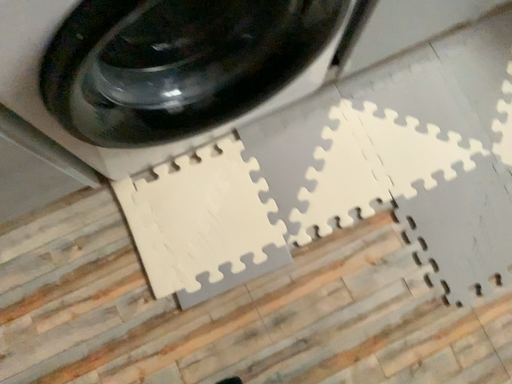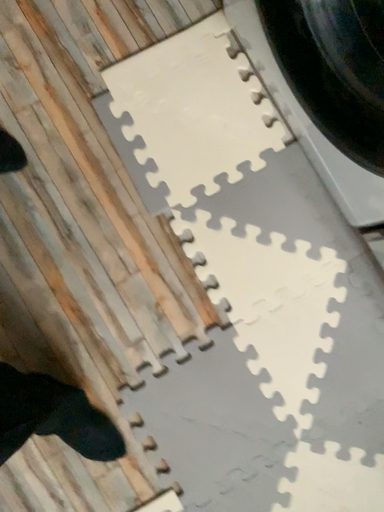
Question: Which way did the camera rotate in the video?

Choices:
 (A) rotated right
 (B) rotated left

Answer: (B)